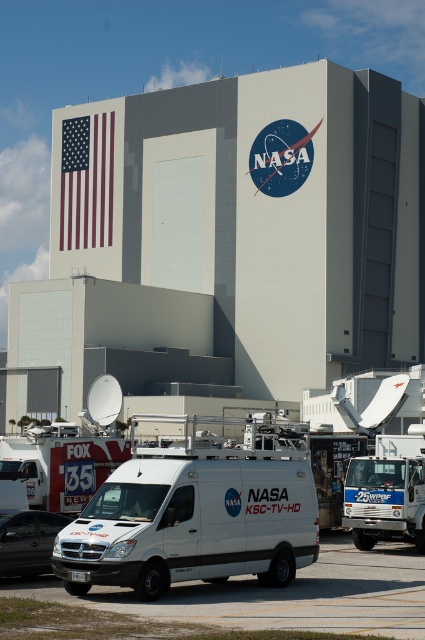
You are standing at the entrance of the NASA facility and want to walk to the point marked by the coordinates. Which coordinate point, point (206, 598) or point (104, 161), is closer to you?

Point (206, 598) is in front of point (104, 161), so it is closer to you.

You are a delivery driver who needs to park your truck, which is 2 meters wide, on the white smooth tarmac at lower center. The black matte van at lower left is already parked there. Can you park your truck next to the van without overlapping?

The white smooth tarmac at lower center might be wider than black matte van at lower left, so there is a possibility that the tarmac is wide enough to accommodate the truck next to the van. However, since the exact width difference isn